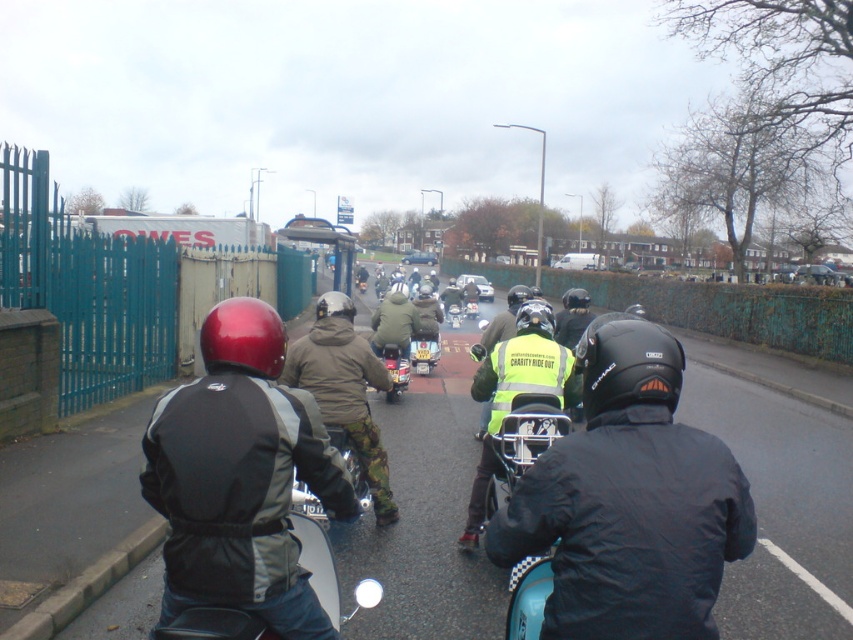
You are a photographer positioned at the origin of the coordinate system. You see a point marked at coordinate point (241, 477). What object is located at that point?

The point at coordinate (241, 477) corresponds to the matte black jacket at center.

You are a photographer trying to capture both the matte black jacket at center and the camouflage jacket at center in a single shot. Given that your camera frame can only accommodate objects of equal width, will you need to adjust your framing to include both?

The matte black jacket at center is wider than the camouflage jacket at center, so you will need to adjust your framing to ensure both are fully captured since their widths are not equal.

You are a photographer positioned at the origin point of the image. You want to capture a photo of the camouflage jacket at center. According to the coordinates provided, in which direction should you aim your camera to ensure the jacket is centered in the frame?

The camouflage jacket at center is located at coordinates point (x=393, y=323), so you should aim your camera slightly to the right and down from the center to capture it.